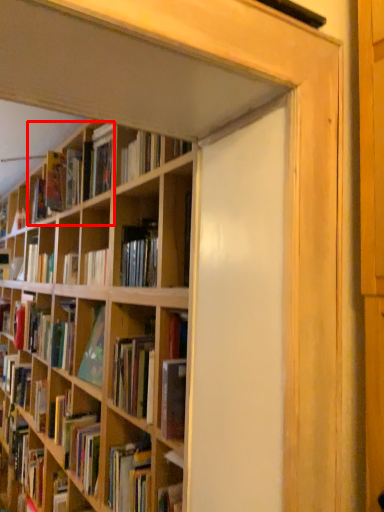
Question: From the image's perspective, where is book (annotated by the red box) located relative to book?

Choices:
 (A) above
 (B) below

Answer: (A)